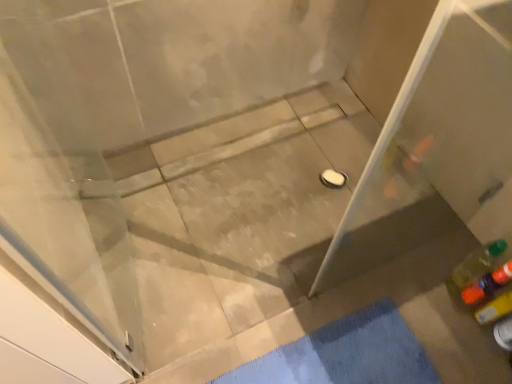
This screenshot has height=384, width=512. What are the coordinates of `free space behind translucent plastic bottle at lower right` in the screenshot? It's located at (448, 241).